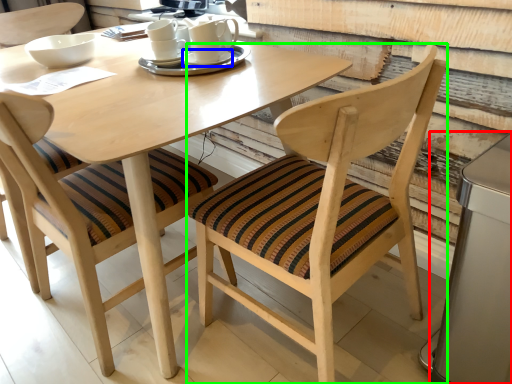
Question: Based on their relative distances, which object is nearer to appliance (highlighted by a red box)? Choose from saucer (highlighted by a blue box) and chair (highlighted by a green box).

Choices:
 (A) saucer
 (B) chair

Answer: (B)